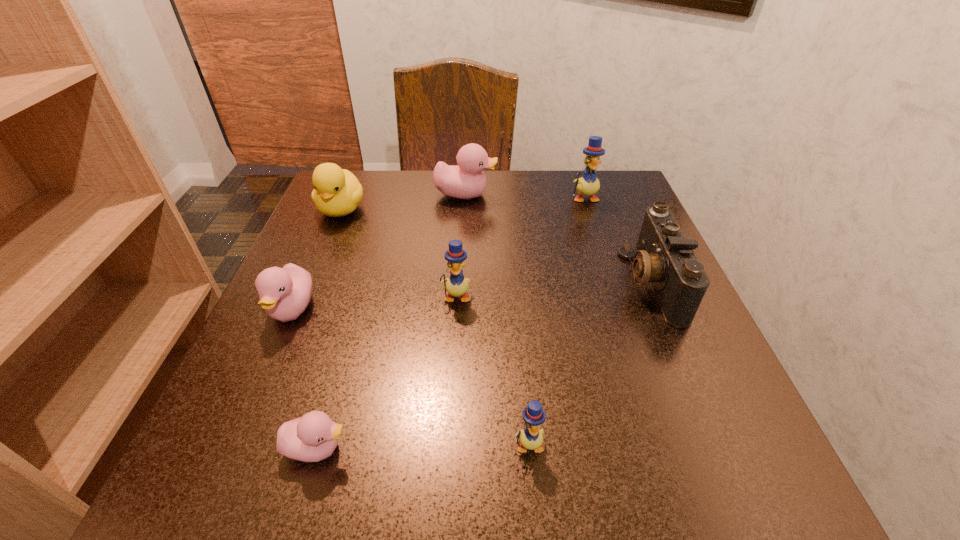
At what (x,y) coordinates should I click in order to perform the action: click on free region located on the front-facing side of the camera. Please return your answer as a coordinate pair (x, y). This screenshot has width=960, height=540. Looking at the image, I should click on (471, 282).

The width and height of the screenshot is (960, 540). In order to click on vacant region located 0.130m on the front-facing side of the leftmost pink duckling in this screenshot , I will do `click(251, 407)`.

Locate an element on the screen. This screenshot has height=540, width=960. vacant space located on the front-facing side of the nearest pink duckling is located at coordinates (420, 448).

Locate an element on the screen. The image size is (960, 540). duck present at the far edge is located at coordinates (337, 192).

The height and width of the screenshot is (540, 960). I want to click on duck that is positioned at the left edge, so click(337, 192).

The image size is (960, 540). I want to click on duckling that is at the right edge, so click(588, 184).

Image resolution: width=960 pixels, height=540 pixels. Identify the location of camera present at the right edge. (664, 257).

This screenshot has height=540, width=960. Find the location of `object that is at the far left corner`. object that is at the far left corner is located at coordinates (337, 192).

Where is `object present at the near left corner`? This screenshot has width=960, height=540. object present at the near left corner is located at coordinates point(311,438).

At what (x,y) coordinates should I click in order to perform the action: click on object situated at the far right corner. Please return your answer as a coordinate pair (x, y). The height and width of the screenshot is (540, 960). Looking at the image, I should click on coord(588,184).